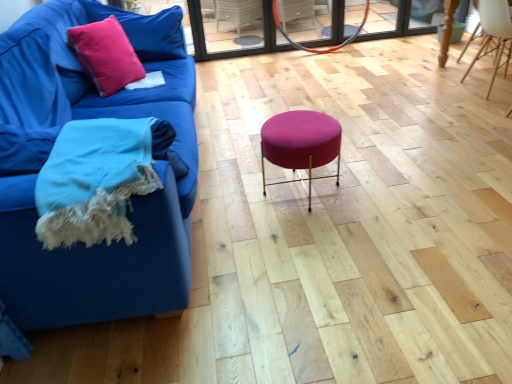
The height and width of the screenshot is (384, 512). I want to click on matte pink fabric stool at center, so click(300, 143).

Image resolution: width=512 pixels, height=384 pixels. Describe the element at coordinates (94, 181) in the screenshot. I see `woolen blue blanket at lower left` at that location.

What do you see at coordinates (133, 197) in the screenshot? I see `matte blue fabric couch at left` at bounding box center [133, 197].

Image resolution: width=512 pixels, height=384 pixels. Identify the location of matte pink fabric stool at center. (300, 143).

Could you tell me if white wood chair at upper right is turned towards pink velvet pillow at upper left?

No, white wood chair at upper right is not oriented towards pink velvet pillow at upper left.

Can you confirm if white wood chair at upper right is positioned to the left of pink velvet pillow at upper left?

No.

Would you say pink velvet pillow at upper left is part of white wood chair at upper right's contents?

That's incorrect, pink velvet pillow at upper left is not inside white wood chair at upper right.

From a real-world perspective, relative to transparent glass door at upper center, is white wood chair at upper right vertically above or below?

In terms of real-world spatial position, white wood chair at upper right is below transparent glass door at upper center.

Who is more distant, white wood chair at upper right or transparent glass door at upper center?

Positioned behind is transparent glass door at upper center.

Is white wood chair at upper right shorter than transparent glass door at upper center?

No.

In the image, there is a white wood chair at upper right. Where is `glass door above it (from the image's perspective)`? glass door above it (from the image's perspective) is located at coordinates (236, 49).

Considering the relative sizes of pink velvet pillow at upper left and transparent glass door at upper center in the image provided, is pink velvet pillow at upper left smaller than transparent glass door at upper center?

Yes, pink velvet pillow at upper left is smaller than transparent glass door at upper center.

Is pink velvet pillow at upper left not within transparent glass door at upper center?

Yes, pink velvet pillow at upper left is not within transparent glass door at upper center.

Considering the relative positions of pink velvet pillow at upper left and transparent glass door at upper center in the image provided, is pink velvet pillow at upper left to the left of transparent glass door at upper center from the viewer's perspective?

Yes, pink velvet pillow at upper left is to the left of transparent glass door at upper center.

Considering the relative positions of pink velvet pillow at upper left and transparent glass door at upper center in the image provided, is pink velvet pillow at upper left behind transparent glass door at upper center?

No, pink velvet pillow at upper left is closer to the camera.

Is matte pink cushion at upper left bigger or smaller than matte pink fabric stool at center?

Clearly, matte pink cushion at upper left is smaller in size than matte pink fabric stool at center.

Is matte pink cushion at upper left positioned beyond the bounds of matte pink fabric stool at center?

Yes, matte pink cushion at upper left is outside of matte pink fabric stool at center.

From the image's perspective, who appears lower, matte pink cushion at upper left or matte pink fabric stool at center?

matte pink fabric stool at center appears lower in the image.

How different are the orientations of matte pink cushion at upper left and matte pink fabric stool at center in degrees?

The angular difference between matte pink cushion at upper left and matte pink fabric stool at center is 22.1 degrees.

From a real-world perspective, which object rests below the other?

From a 3D spatial view, white wood chair at upper right is below.

Are white wood chair at upper right and matte pink cushion at upper left located far from each other?

Yes, white wood chair at upper right and matte pink cushion at upper left are quite far apart.

Does point (485, 32) come closer to viewer compared to point (111, 81)?

No.

In the image, is white wood chair at upper right positioned in front of or behind matte pink cushion at upper left?

white wood chair at upper right is positioned farther from the viewer than matte pink cushion at upper left.

From the image's perspective, is matte blue fabric couch at left above or below transparent glass door at upper center?

Based on their image positions, matte blue fabric couch at left is located beneath transparent glass door at upper center.

From a real-world perspective, is matte blue fabric couch at left below transparent glass door at upper center?

Incorrect, from a real-world perspective, matte blue fabric couch at left is higher than transparent glass door at upper center.

Is point (170, 269) closer to camera compared to point (199, 55)?

Yes, it is in front of point (199, 55).

From the image's perspective, is matte pink fabric stool at center located beneath matte pink cushion at upper left?

Indeed, from the image's perspective, matte pink fabric stool at center is shown beneath matte pink cushion at upper left.

Is matte pink fabric stool at center oriented away from matte pink cushion at upper left?

No, matte pink fabric stool at center is not facing away from matte pink cushion at upper left.

You are a GUI agent. You are given a task and a screenshot of the screen. Output one action in this format:
    pyautogui.click(x=<x>, y=<y>)
    Task: Click on the throw pillow on the left side of matte pink fabric stool at center
    This screenshot has height=384, width=512.
    Given the screenshot: What is the action you would take?
    pyautogui.click(x=105, y=55)

How much distance is there between matte pink fabric stool at center and matte pink cushion at upper left?

matte pink fabric stool at center is 3.65 feet from matte pink cushion at upper left.

In order to click on chair located below the pink velvet pillow at upper left (from the image's perspective) in this screenshot , I will do `click(494, 34)`.

Locate an element on the screen. glass door above the white wood chair at upper right (from the image's perspective) is located at coordinates (236, 49).

Estimate the real-world distances between objects in this image. Which object is closer to transparent glass door at upper center, matte blue fabric couch at left or matte pink cushion at upper left?

matte pink cushion at upper left lies closer to transparent glass door at upper center than the other object.

Estimate the real-world distances between objects in this image. Which object is closer to white wood chair at upper right, matte pink cushion at upper left or transparent glass door at upper center?

transparent glass door at upper center lies closer to white wood chair at upper right than the other object.

From the image, which object appears to be nearer to matte blue fabric couch at left, white wood chair at upper right or woolen blue blanket at lower left?

woolen blue blanket at lower left is closer to matte blue fabric couch at left.

Looking at the image, which one is located further to pink velvet pillow at upper left, matte pink fabric stool at center or matte blue fabric couch at left?

matte pink fabric stool at center lies further to pink velvet pillow at upper left than the other object.

Looking at the image, which one is located further to transparent glass door at upper center, pink velvet pillow at upper left or white wood chair at upper right?

white wood chair at upper right lies further to transparent glass door at upper center than the other object.

Estimate the real-world distances between objects in this image. Which object is further from matte pink cushion at upper left, matte pink fabric stool at center or white wood chair at upper right?

white wood chair at upper right is positioned further to the anchor matte pink cushion at upper left.

Looking at the image, which one is located closer to matte pink fabric stool at center, woolen blue blanket at lower left or pink velvet pillow at upper left?

Among the two, woolen blue blanket at lower left is located nearer to matte pink fabric stool at center.

Looking at the image, which one is located further to woolen blue blanket at lower left, transparent glass door at upper center or matte pink cushion at upper left?

transparent glass door at upper center.

Identify the location of studio couch between matte pink cushion at upper left and white wood chair at upper right. (133, 197).

This screenshot has width=512, height=384. I want to click on blanket located between matte blue fabric couch at left and white wood chair at upper right in the left-right direction, so click(94, 181).

I want to click on bar stool between woolen blue blanket at lower left and matte pink cushion at upper left from front to back, so click(x=300, y=143).

The width and height of the screenshot is (512, 384). I want to click on blanket between matte blue fabric couch at left and pink velvet pillow at upper left from front to back, so click(94, 181).